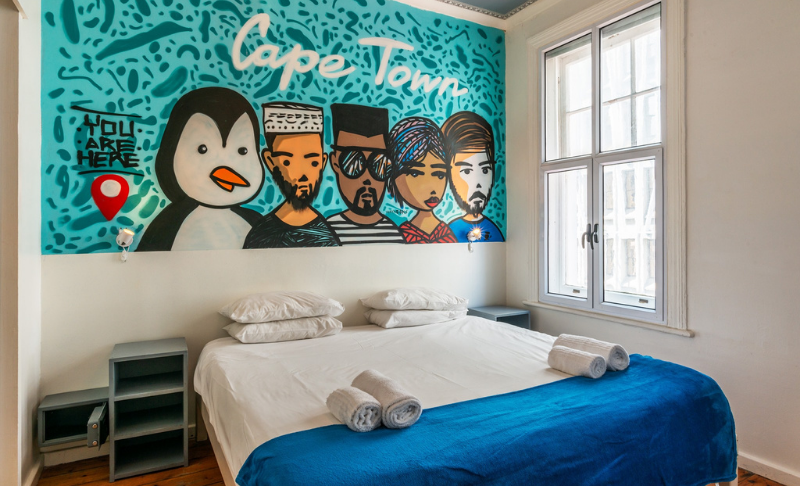
In order to click on safe in this screenshot , I will do `click(73, 411)`.